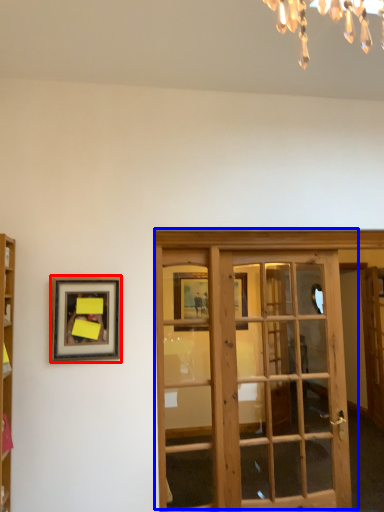
Question: Which object is further to the camera taking this photo, picture frame (highlighted by a red box) or door (highlighted by a blue box)?

Choices:
 (A) picture frame
 (B) door

Answer: (B)